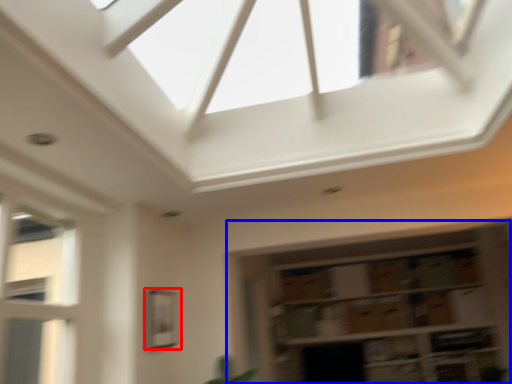
Question: Which point is closer to the camera, window (highlighted by a red box) or shelf (highlighted by a blue box)?

Choices:
 (A) window
 (B) shelf

Answer: (A)